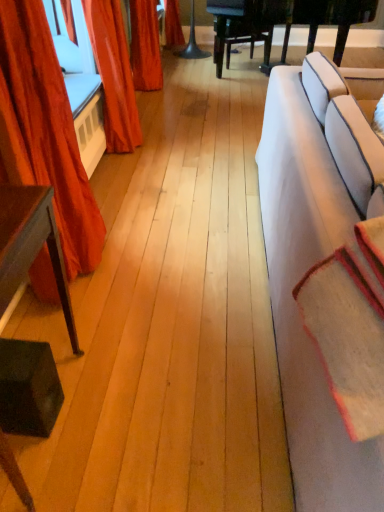
This screenshot has height=512, width=384. Identify the location of vacant space in between velvet red curtain at left, acting as the 2th curtain starting from the back, and dark brown wood table at left. (61, 315).